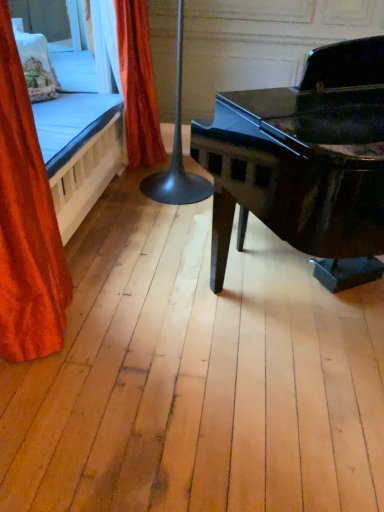
Question: Is black glossy table lamp at center located within orange velvet curtain at upper left, the first curtain in the back-to-front sequence?

Choices:
 (A) no
 (B) yes

Answer: (A)

Question: Does orange velvet curtain at upper left, the first curtain in the back-to-front sequence, have a greater width compared to black glossy table lamp at center?

Choices:
 (A) yes
 (B) no

Answer: (B)

Question: From the image's perspective, is orange velvet curtain at upper left, the first curtain in the back-to-front sequence, under black glossy table lamp at center?

Choices:
 (A) no
 (B) yes

Answer: (A)

Question: Can you confirm if orange velvet curtain at upper left, the first curtain in the back-to-front sequence, is bigger than black glossy table lamp at center?

Choices:
 (A) yes
 (B) no

Answer: (B)

Question: Is orange velvet curtain at upper left, which ranks as the 2th curtain in front-to-back order, taller than black glossy table lamp at center?

Choices:
 (A) yes
 (B) no

Answer: (B)

Question: Can you confirm if orange velvet curtain at upper left, the first curtain in the back-to-front sequence, is positioned to the left of black glossy table lamp at center?

Choices:
 (A) yes
 (B) no

Answer: (A)

Question: Considering the relative positions of orange velvet curtain at upper left, the first curtain in the back-to-front sequence, and embroidered fabric pillow at upper left in the image provided, is orange velvet curtain at upper left, the first curtain in the back-to-front sequence, to the right of embroidered fabric pillow at upper left from the viewer's perspective?

Choices:
 (A) no
 (B) yes

Answer: (B)

Question: From a real-world perspective, is orange velvet curtain at upper left, which ranks as the 2th curtain in front-to-back order, beneath embroidered fabric pillow at upper left?

Choices:
 (A) yes
 (B) no

Answer: (A)

Question: Is orange velvet curtain at upper left, which ranks as the 2th curtain in front-to-back order, further to the viewer compared to embroidered fabric pillow at upper left?

Choices:
 (A) no
 (B) yes

Answer: (A)

Question: Is orange velvet curtain at upper left, the first curtain in the back-to-front sequence, positioned with its back to embroidered fabric pillow at upper left?

Choices:
 (A) no
 (B) yes

Answer: (B)

Question: Considering the relative sizes of orange velvet curtain at upper left, the first curtain in the back-to-front sequence, and embroidered fabric pillow at upper left in the image provided, is orange velvet curtain at upper left, the first curtain in the back-to-front sequence, wider than embroidered fabric pillow at upper left?

Choices:
 (A) yes
 (B) no

Answer: (A)

Question: Is orange velvet curtain at upper left, which ranks as the 2th curtain in front-to-back order, at the left side of embroidered fabric pillow at upper left?

Choices:
 (A) no
 (B) yes

Answer: (A)

Question: From a real-world perspective, is embroidered fabric pillow at upper left positioned under orange velvet curtain at left, marked as the 1th curtain in a front-to-back arrangement, based on gravity?

Choices:
 (A) no
 (B) yes

Answer: (A)